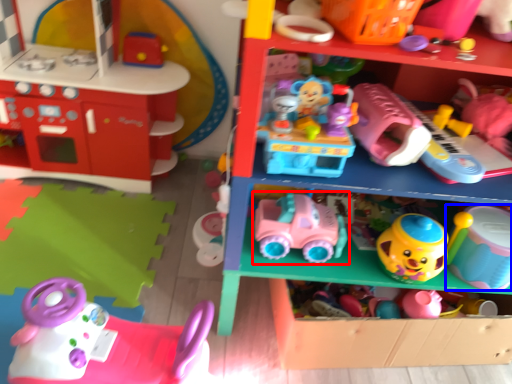
Question: Which object is further to the camera taking this photo, toy (highlighted by a red box) or toy (highlighted by a blue box)?

Choices:
 (A) toy
 (B) toy

Answer: (A)